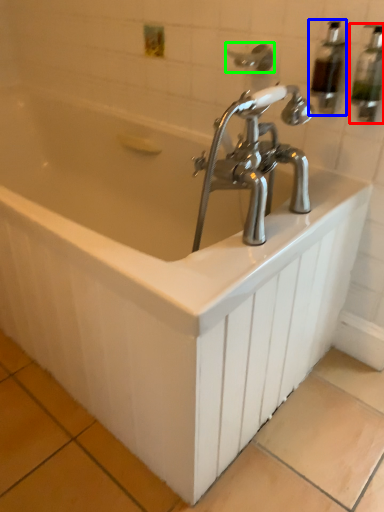
Question: Estimate the real-world distances between objects in this image. Which object is farther from soap dispenser (highlighted by a red box), soap dispenser (highlighted by a blue box) or shower (highlighted by a green box)?

Choices:
 (A) soap dispenser
 (B) shower

Answer: (B)